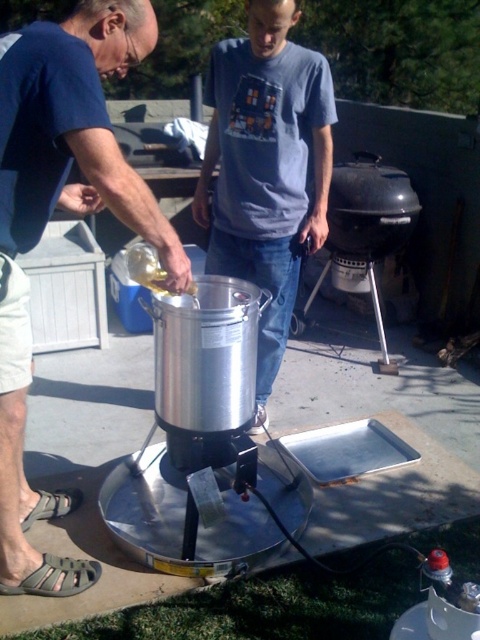
Which is above, brushed metal pot at left or gray cotton shirt at center?

gray cotton shirt at center

Who is more forward, (1, 460) or (312, 148)?

Point (1, 460) is in front.

Does point (11, 202) lie behind point (254, 157)?

No, (11, 202) is closer to viewer.

Locate an element on the screen. The height and width of the screenshot is (640, 480). brushed metal pot at left is located at coordinates click(x=47, y=221).